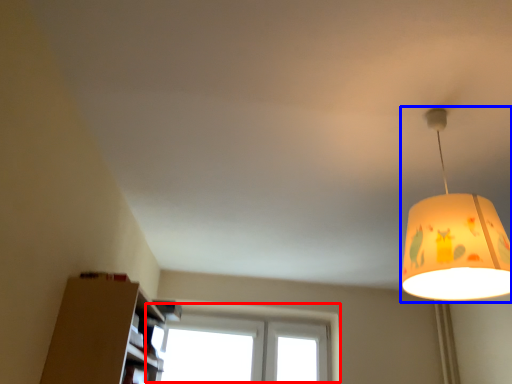
Question: Among these objects, which one is farthest to the camera, window (highlighted by a red box) or lamp (highlighted by a blue box)?

Choices:
 (A) window
 (B) lamp

Answer: (A)